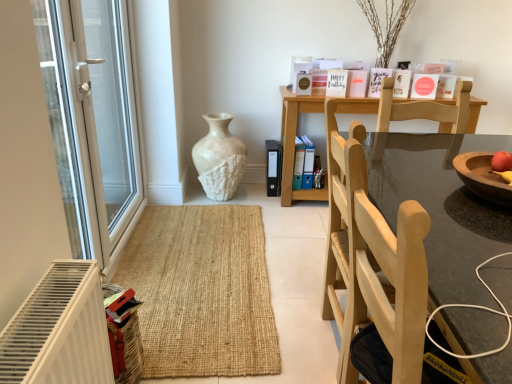
Question: From the image's perspective, is transparent glass door at left above or below blue plastic file at center, which appears as the 1th book when ordered from the bottom?

Choices:
 (A) below
 (B) above

Answer: (B)

Question: Considering the relative positions of transparent glass door at left and blue plastic file at center, which is counted as the first book, starting from the left, in the image provided, is transparent glass door at left to the left or to the right of blue plastic file at center, which is counted as the first book, starting from the left,?

Choices:
 (A) left
 (B) right

Answer: (A)

Question: Which of these objects is positioned closest to the matte white card at upper center, acting as the 1th book starting from the right?

Choices:
 (A) blue plastic file at center, which is counted as the first book, starting from the left
 (B) wooden round table at center
 (C) white textured vase at center
 (D) transparent glass door at left

Answer: (A)

Question: Estimate the real-world distances between objects in this image. Which object is farther from the white textured vase at center?

Choices:
 (A) blue plastic file at center, the first book positioned from the back
 (B) transparent glass door at left
 (C) wooden round table at center
 (D) matte white card at upper center, the second book in the left-to-right sequence

Answer: (C)